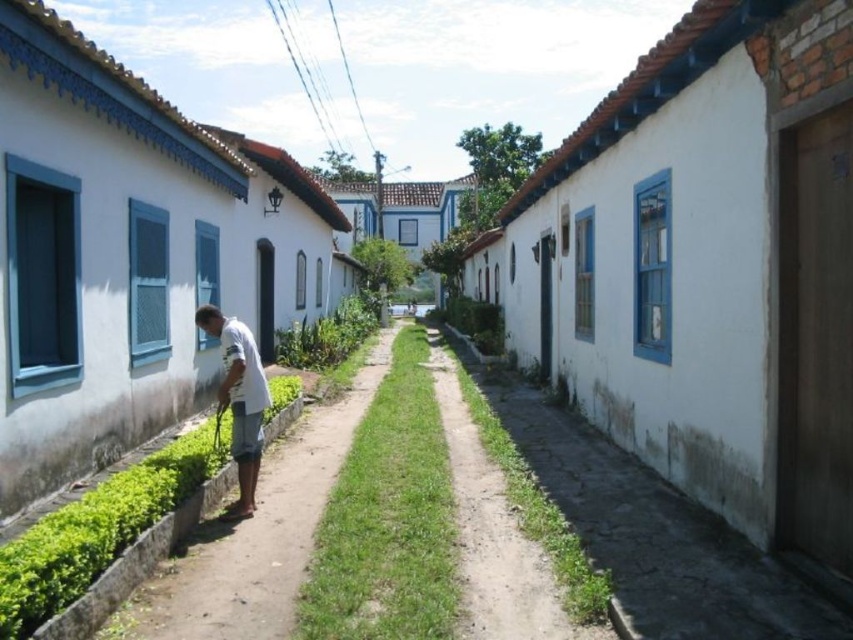
Consider the image. Between white rough concrete path at lower right and white matte man at center, which one has more height?

Standing taller between the two is white matte man at center.

Which of these two, white rough concrete path at lower right or white matte man at center, stands shorter?

white rough concrete path at lower right is shorter.

Is point (709, 596) closer to viewer compared to point (271, 493)?

Yes, point (709, 596) is closer to viewer.

Locate an element on the screen. Image resolution: width=853 pixels, height=640 pixels. white rough concrete path at lower right is located at coordinates (650, 531).

Is white rough concrete path at lower right further to camera compared to white cotton shirt at center?

No, white rough concrete path at lower right is closer to the viewer.

Can you confirm if white rough concrete path at lower right is positioned above white cotton shirt at center?

No.

Between point (656, 506) and point (241, 420), which one is positioned in front?

Positioned in front is point (656, 506).

I want to click on white rough concrete path at lower right, so click(x=650, y=531).

Based on the photo, is white matte man at center wider than white cotton shirt at center?

Yes.

Between white matte man at center and white cotton shirt at center, which one is positioned higher?

white cotton shirt at center

You are a GUI agent. You are given a task and a screenshot of the screen. Output one action in this format:
    pyautogui.click(x=<x>, y=<y>)
    Task: Click on the white matte man at center
    
    Given the screenshot: What is the action you would take?
    pyautogui.click(x=257, y=534)